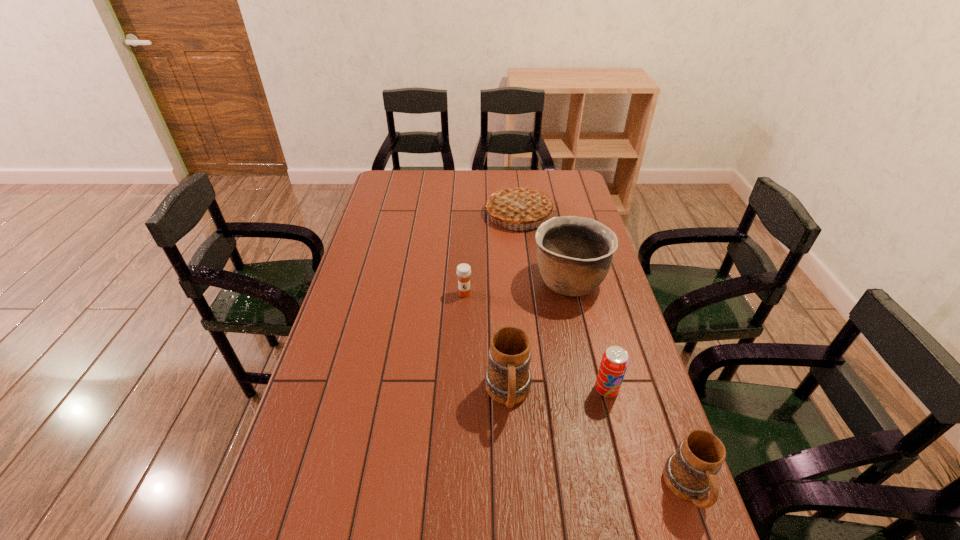
Find the location of a particular element. the farther mug is located at coordinates click(x=508, y=378).

Locate an element on the screen. the left mug is located at coordinates (508, 378).

Identify the location of the nearest object. [689, 473].

Locate an element on the screen. The image size is (960, 540). the right mug is located at coordinates (689, 473).

At what (x,y) coordinates should I click in order to perform the action: click on the farthest object. Please return your answer as a coordinate pair (x, y). Looking at the image, I should click on (517, 204).

Locate an element on the screen. medicine is located at coordinates (463, 271).

Identify the location of the leftmost object. (463, 271).

Where is `pottery`? pottery is located at coordinates (574, 254).

I want to click on soda can, so click(614, 363).

At what (x,y) coordinates should I click in order to perform the action: click on vacant space located 0.160m on the side of the taller mug with the handle. Please return your answer as a coordinate pair (x, y). The width and height of the screenshot is (960, 540). Looking at the image, I should click on [x=514, y=489].